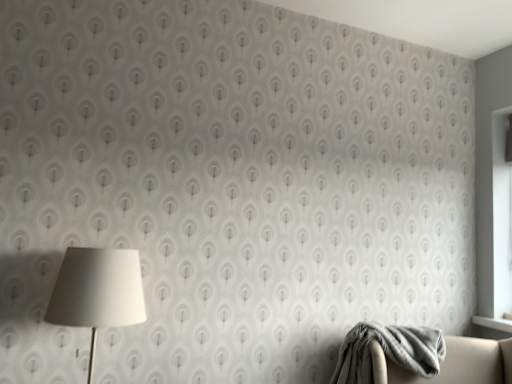
Question: From a real-world perspective, is gray soft blanket at lower right positioned above or below white matte lamp at left?

Choices:
 (A) above
 (B) below

Answer: (B)

Question: Considering the positions of gray soft blanket at lower right and white matte lamp at left in the image, is gray soft blanket at lower right bigger or smaller than white matte lamp at left?

Choices:
 (A) big
 (B) small

Answer: (A)

Question: Is gray soft blanket at lower right in front of or behind white matte lamp at left in the image?

Choices:
 (A) behind
 (B) front

Answer: (A)

Question: Considering the positions of white matte lamp at left and gray soft blanket at lower right in the image, is white matte lamp at left taller or shorter than gray soft blanket at lower right?

Choices:
 (A) tall
 (B) short

Answer: (A)

Question: Considering the positions of point (82, 248) and point (398, 334), is point (82, 248) closer or farther from the camera than point (398, 334)?

Choices:
 (A) farther
 (B) closer

Answer: (B)

Question: Considering the relative positions of white matte lamp at left and gray soft blanket at lower right in the image provided, is white matte lamp at left to the left or to the right of gray soft blanket at lower right?

Choices:
 (A) right
 (B) left

Answer: (B)

Question: Is white matte lamp at left bigger or smaller than gray soft blanket at lower right?

Choices:
 (A) big
 (B) small

Answer: (B)